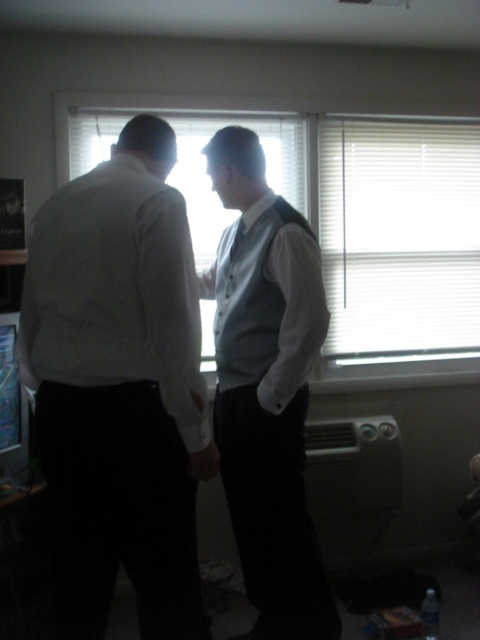
You are an interior designer analyzing the placement of objects in the room. Given the coordinates provided for the matte white shirt at left, can you determine its position relative to the window with partially open blinds?

The matte white shirt at left is located at point 0.606 on the x axis and 0.248 on the y axis, which places it to the right side of the window with partially open blinds.

You are a tailor measuring the distance between the matte white shirt at left and the silky white tie at center. The minimum distance required for proper fitting is 30 inches. Is the current distance sufficient?

The matte white shirt at left and silky white tie at center are 29.74 inches apart from each other, which is less than the required 30 inches. Therefore, the current distance is insufficient for proper fitting.